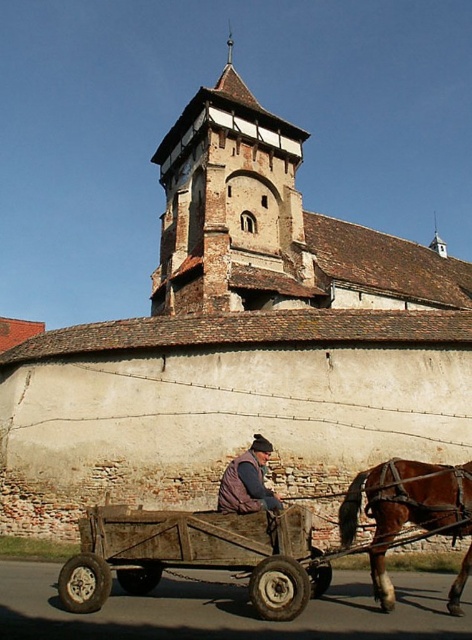
You are standing in front of the fortified church and want to reach the base of the brown stone tower at upper center. There is a dark brown leather jacket at center in your path. Which object will you encounter first?

You will first encounter the dark brown leather jacket at center because it is closer to you than the brown stone tower at upper center, which is further away.

What are the coordinates of the brown stone tower at upper center in the image?

The coordinates of the brown stone tower at upper center are at point (230, 205).

You are a tourist visiting the fortified church and want to take a photo of the brown stone tower at upper center and the dark brown leather jacket at center. Which object should you focus on first if you want to capture both in a single frame without moving the camera?

You should focus on the dark brown leather jacket at center first because the brown stone tower at upper center is much taller and will occupy more of the frame, potentially making the jacket appear smaller. By focusing on the jacket first, you can ensure both are in clear view.